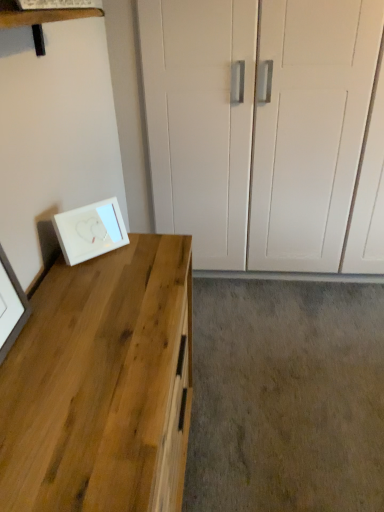
The height and width of the screenshot is (512, 384). In order to click on free location to the right of white glossy picture frame at lower left in this screenshot , I will do `click(150, 253)`.